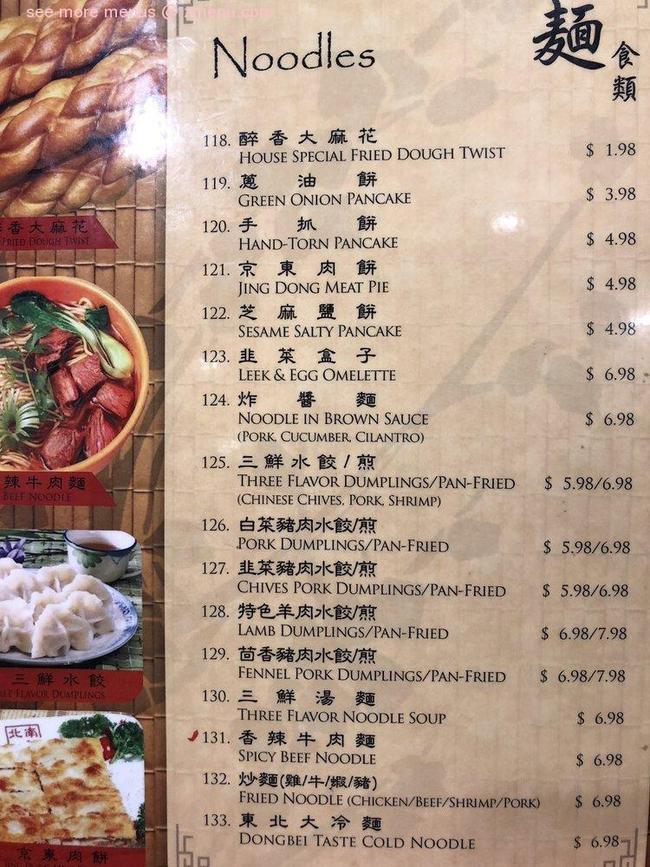
Find the location of `cup`. cup is located at coordinates (116, 562).